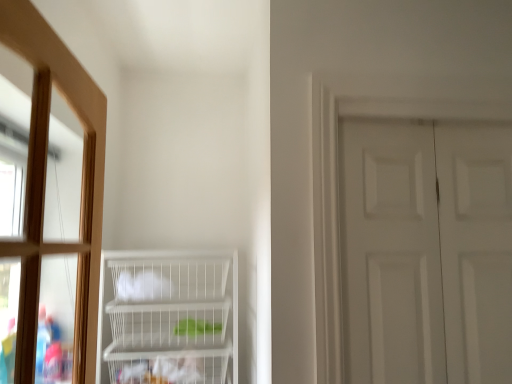
Question: Can you confirm if white matte door at right is thinner than clear glass window at left?

Choices:
 (A) yes
 (B) no

Answer: (A)

Question: Considering the relative positions of white matte door at right and clear glass window at left in the image provided, is white matte door at right behind clear glass window at left?

Choices:
 (A) yes
 (B) no

Answer: (A)

Question: From the image's perspective, is white matte door at right over clear glass window at left?

Choices:
 (A) yes
 (B) no

Answer: (B)

Question: Does white matte door at right have a greater width compared to clear glass window at left?

Choices:
 (A) no
 (B) yes

Answer: (A)

Question: From a real-world perspective, is white matte door at right located higher than clear glass window at left?

Choices:
 (A) yes
 (B) no

Answer: (B)

Question: Is white matte door at right smaller than clear glass window at left?

Choices:
 (A) yes
 (B) no

Answer: (A)

Question: Considering the relative sizes of white matte door at right and white wire basket at lower center in the image provided, is white matte door at right wider than white wire basket at lower center?

Choices:
 (A) yes
 (B) no

Answer: (B)

Question: Does white matte door at right appear on the right side of white wire basket at lower center?

Choices:
 (A) yes
 (B) no

Answer: (A)

Question: Does white matte door at right come in front of white wire basket at lower center?

Choices:
 (A) yes
 (B) no

Answer: (A)

Question: From the image's perspective, is white matte door at right located beneath white wire basket at lower center?

Choices:
 (A) yes
 (B) no

Answer: (B)

Question: Can you confirm if white matte door at right is bigger than white wire basket at lower center?

Choices:
 (A) no
 (B) yes

Answer: (A)

Question: Considering the relative sizes of white matte door at right and white wire basket at lower center in the image provided, is white matte door at right thinner than white wire basket at lower center?

Choices:
 (A) no
 (B) yes

Answer: (B)

Question: Does clear glass window at left come behind white wire basket at lower center?

Choices:
 (A) no
 (B) yes

Answer: (A)